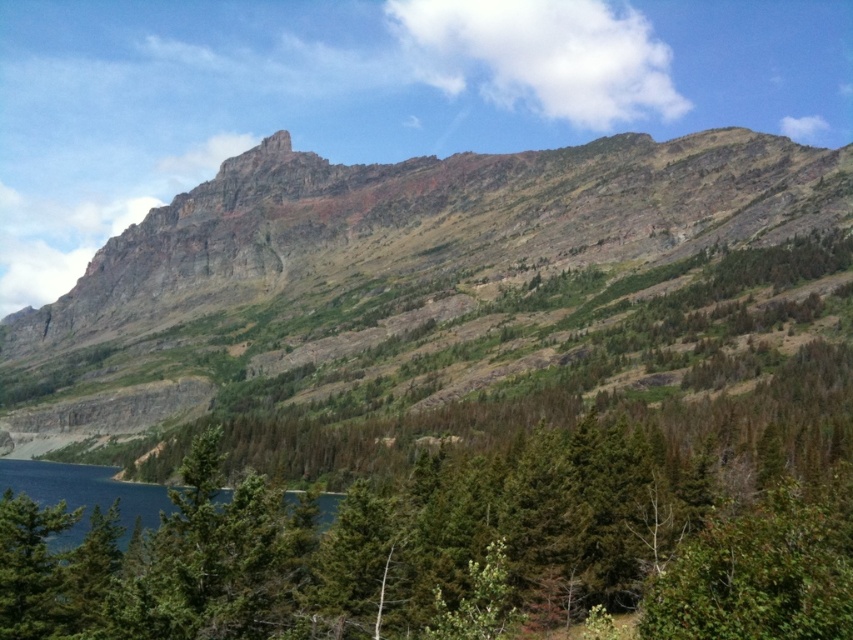
Question: Which point is farther to the camera?

Choices:
 (A) (532, 180)
 (B) (22, 577)
 (C) (125, 508)

Answer: (A)

Question: Estimate the real-world distances between objects in this image. Which object is farther from the rugged stone mountain at upper center?

Choices:
 (A) deep blue water at lower left
 (B) green matte tree at lower left

Answer: (B)

Question: Does rugged stone mountain at upper center appear on the right side of green matte tree at lower left?

Choices:
 (A) yes
 (B) no

Answer: (A)

Question: Which object is positioned closest to the deep blue water at lower left?

Choices:
 (A) green matte tree at lower left
 (B) rugged stone mountain at upper center

Answer: (A)

Question: Is rugged stone mountain at upper center closer to the viewer compared to green matte tree at lower left?

Choices:
 (A) no
 (B) yes

Answer: (A)

Question: Does rugged stone mountain at upper center have a lesser width compared to deep blue water at lower left?

Choices:
 (A) no
 (B) yes

Answer: (A)